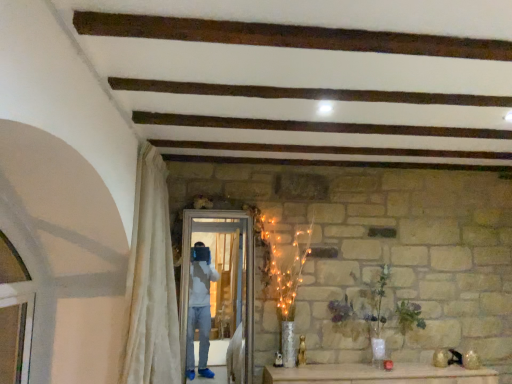
Question: Considering their positions, is white sheer curtain at left located in front of or behind green matte vase at center?

Choices:
 (A) front
 (B) behind

Answer: (A)

Question: Considering the positions of point click(x=163, y=253) and point click(x=382, y=276), is point click(x=163, y=253) closer or farther from the camera than point click(x=382, y=276)?

Choices:
 (A) farther
 (B) closer

Answer: (B)

Question: Which object is positioned closest to the white glossy screen door at center?

Choices:
 (A) green matte vase at center
 (B) white sheer curtain at left

Answer: (B)

Question: Considering the real-world distances, which object is closest to the white sheer curtain at left?

Choices:
 (A) green matte vase at center
 (B) white glossy screen door at center

Answer: (B)